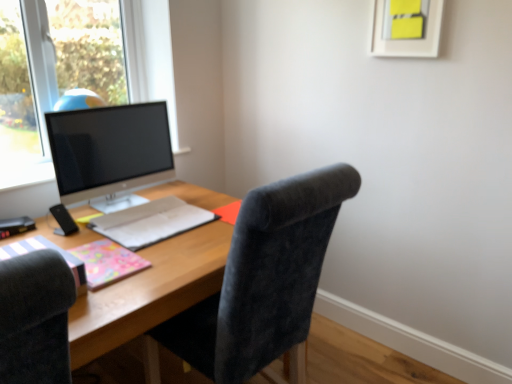
Find the location of a particular element. blank space situated above wooden desk at center (from a real-world perspective) is located at coordinates (152, 250).